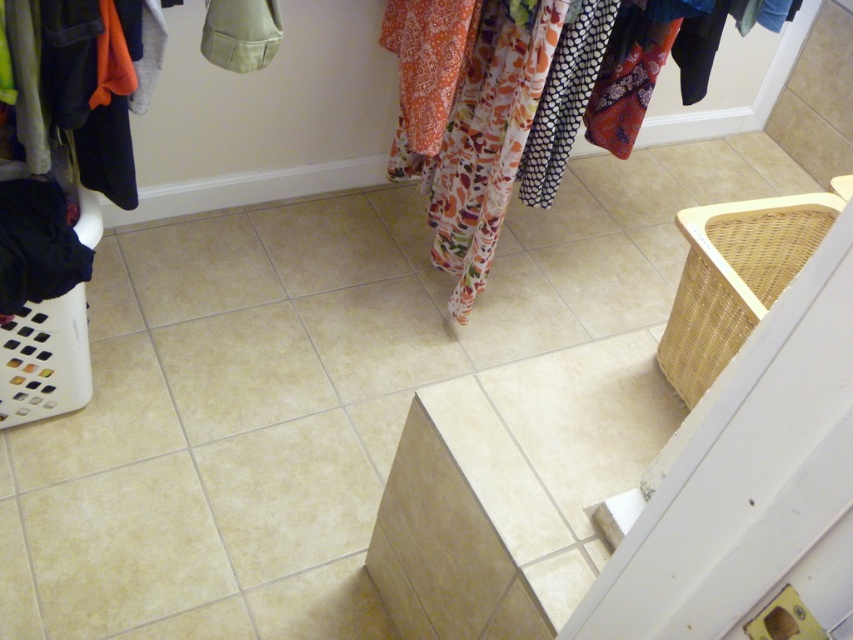
You are standing in the laundry room and need to place a new laundry basket. Where should you place it to match the existing woven beige laundry basket at right?

The woven beige laundry basket at right is located at point (734, 278), so you should place the new laundry basket at the same coordinates to match its position.

You are organizing your laundry and notice the floral fabric clothes at upper center and the woven beige laundry basket at right. Which item takes up more space in the room?

The floral fabric clothes at upper center takes up more space in the room since it is bigger than the woven beige laundry basket at right.